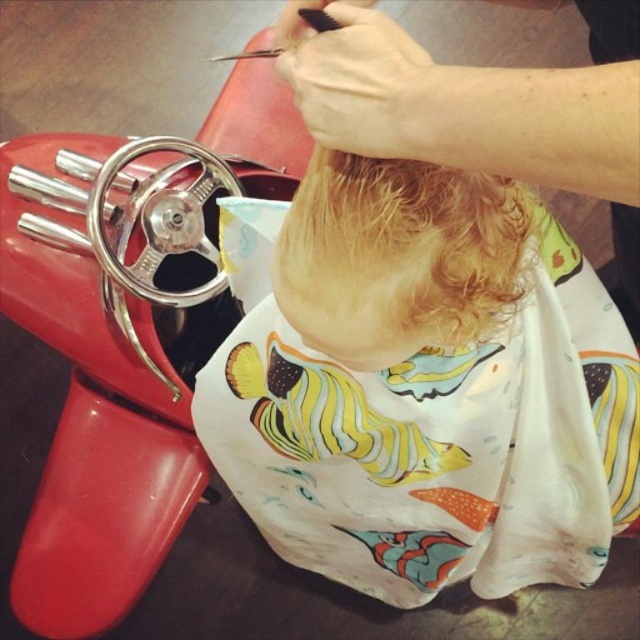
You are a customer in the barbershop and you want to see your child getting a haircut. Are the curly blonde hair at center and the black plastic comb at upper center both visible to you from your current position?

Yes, both the curly blonde hair at center and the black plastic comb at upper center are visible. The curly blonde hair at center is closer to the viewer, so it may partially obscure the black plastic comb at upper upper center but they are both still visible.

From the picture: You are a customer entering the barbershop and see the scene described. There is a specific point marked at coordinates (420, 384). What can you observe at that exact point?

At point (420, 384) lies blonde hair at center.